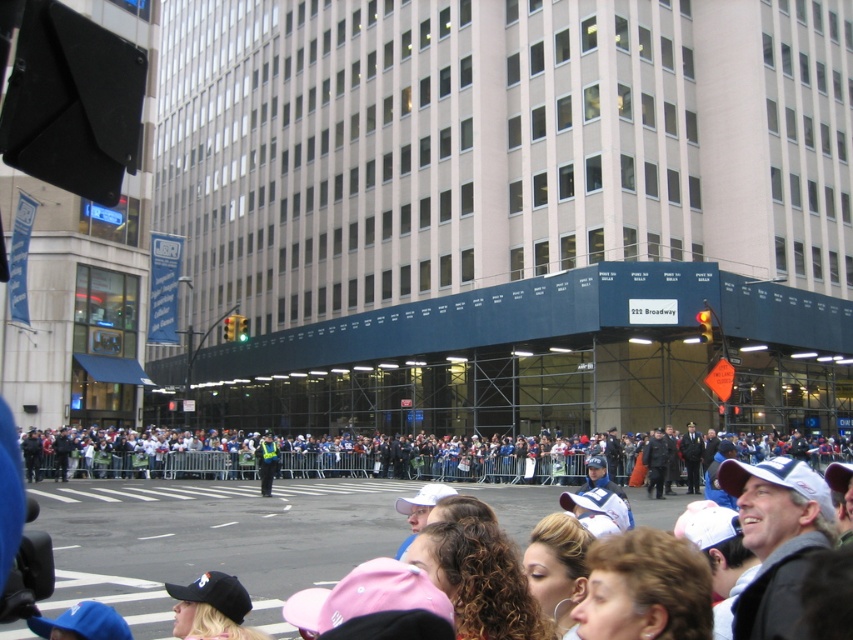
Question: Does white plastic crowd at center have a greater width compared to reflective yellow vest at center?

Choices:
 (A) no
 (B) yes

Answer: (B)

Question: Which point appears closest to the camera in this image?

Choices:
 (A) (326, 452)
 (B) (273, 474)

Answer: (B)

Question: Is white plastic crowd at center bigger than reflective yellow vest at center?

Choices:
 (A) no
 (B) yes

Answer: (B)

Question: In this image, where is white plastic crowd at center located relative to reflective yellow vest at center?

Choices:
 (A) right
 (B) left

Answer: (A)